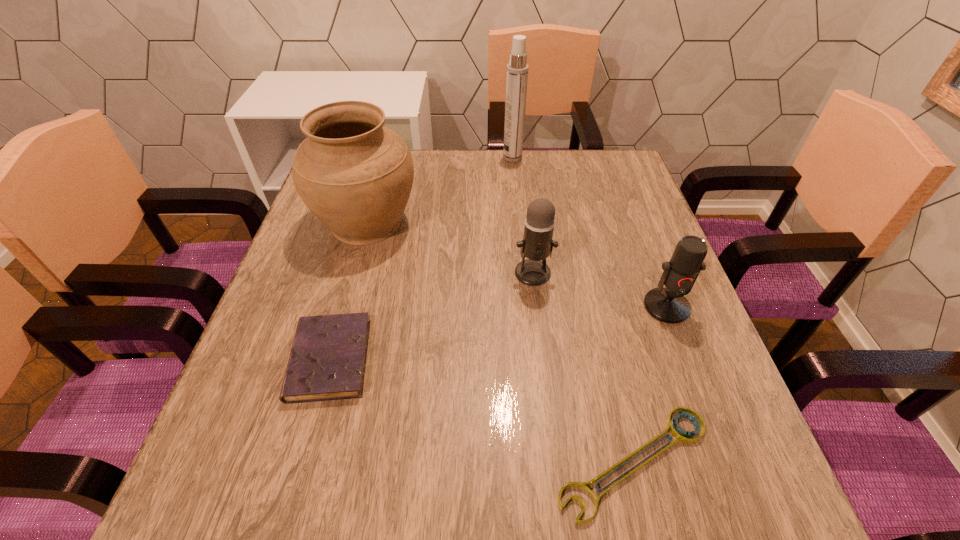
Locate an element on the screen. This screenshot has height=540, width=960. urn at the left edge is located at coordinates coord(355,175).

At what (x,y) coordinates should I click in order to perform the action: click on diary present at the left edge. Please return your answer as a coordinate pair (x, y). Looking at the image, I should click on (327, 361).

Image resolution: width=960 pixels, height=540 pixels. In order to click on microphone situated at the right edge in this screenshot , I will do `click(669, 305)`.

Locate an element on the screen. The image size is (960, 540). wrench situated at the right edge is located at coordinates (682, 436).

Where is `object at the far left corner`? The width and height of the screenshot is (960, 540). object at the far left corner is located at coordinates pos(355,175).

I want to click on object positioned at the near right corner, so click(682, 436).

You are a GUI agent. You are given a task and a screenshot of the screen. Output one action in this format:
    pyautogui.click(x=<x>, y=<y>)
    Task: Click on the vacant space at the far edge
    The image size is (960, 540).
    Given the screenshot: What is the action you would take?
    pyautogui.click(x=533, y=158)

In the image, there is a desktop. At what (x,y) coordinates should I click in order to perform the action: click on vacant space at the near edge. Please return your answer as a coordinate pair (x, y). Looking at the image, I should click on (421, 472).

Where is `vacant region at the left edge`? Image resolution: width=960 pixels, height=540 pixels. vacant region at the left edge is located at coordinates (290, 424).

In the image, there is a desktop. Identify the location of free space at the right edge. This screenshot has height=540, width=960. (642, 424).